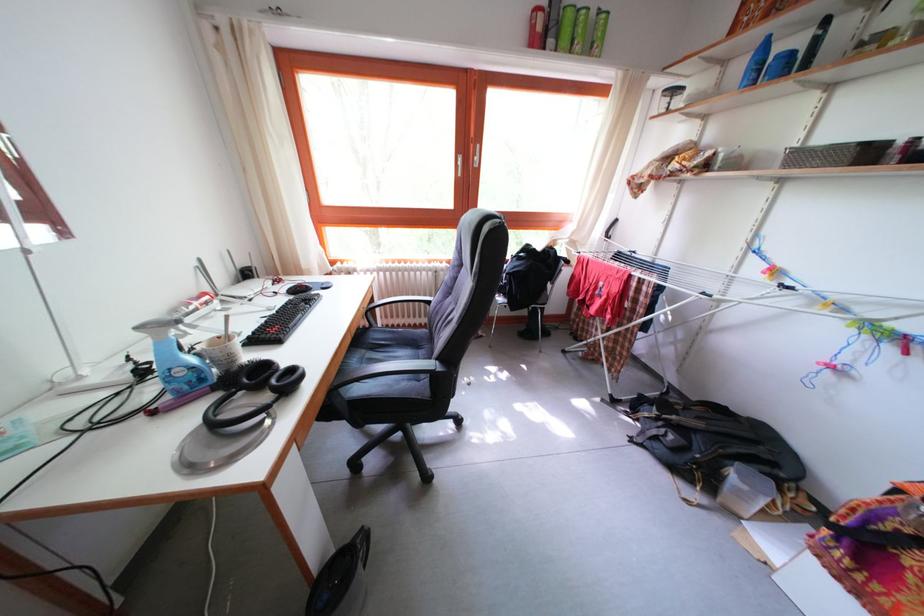
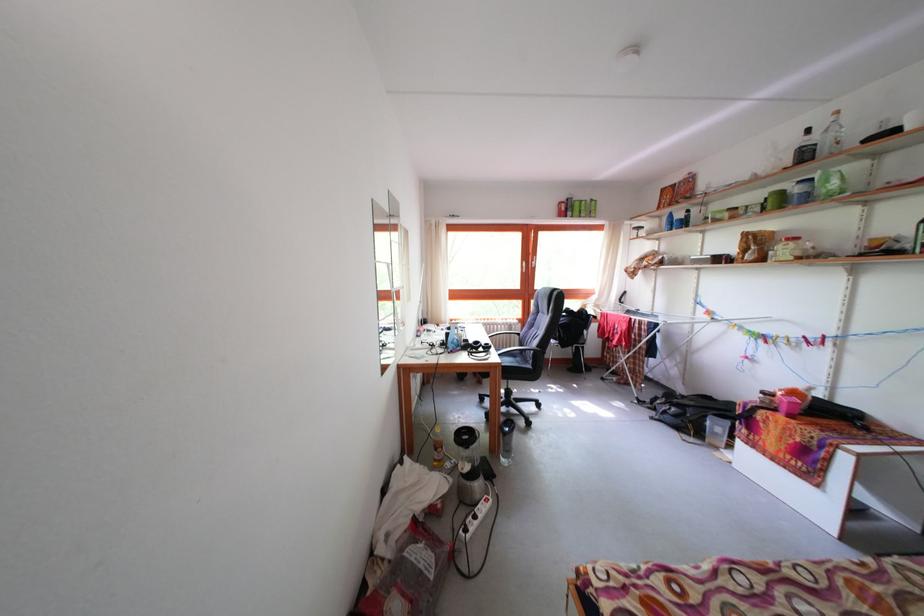
What movement of the cameraman would produce the second image?

The movement direction of the cameraman is left, backward.